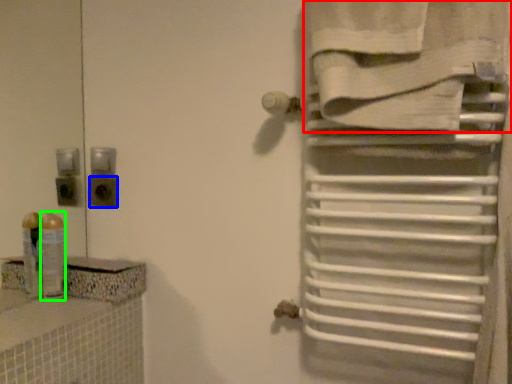
Question: Which object is the closest to the towel (highlighted by a red box)? Choose among these: electric outlet (highlighted by a blue box) or toiletry (highlighted by a green box).

Choices:
 (A) electric outlet
 (B) toiletry

Answer: (A)